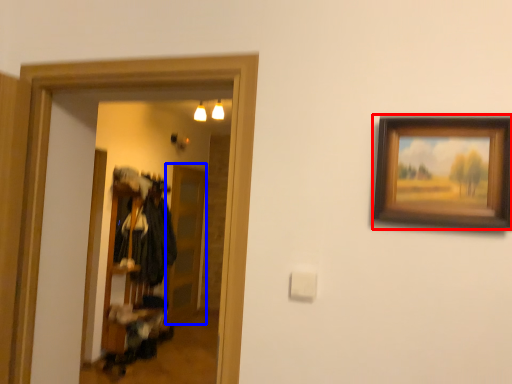
Question: Among these objects, which one is nearest to the camera, picture frame (highlighted by a red box) or glass door (highlighted by a blue box)?

Choices:
 (A) picture frame
 (B) glass door

Answer: (A)